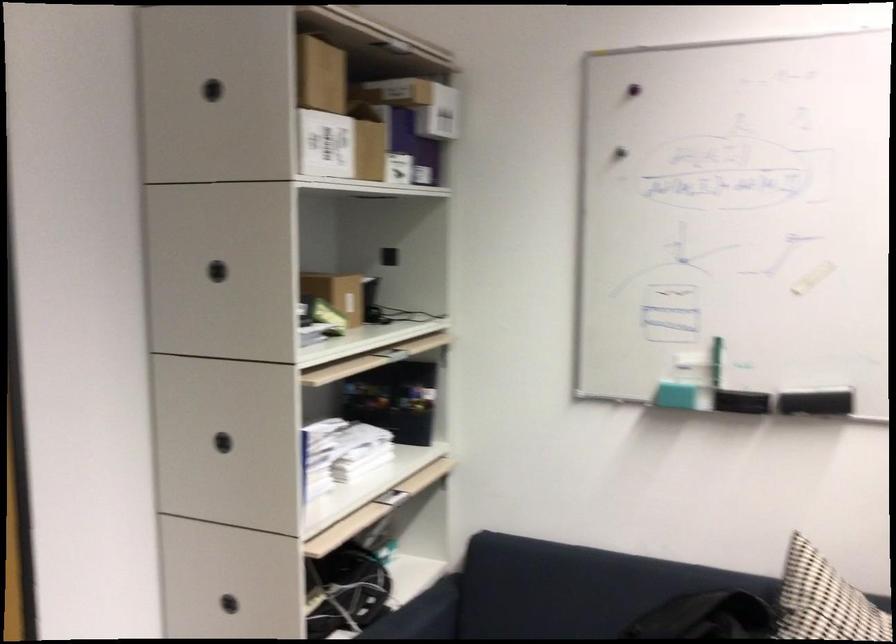
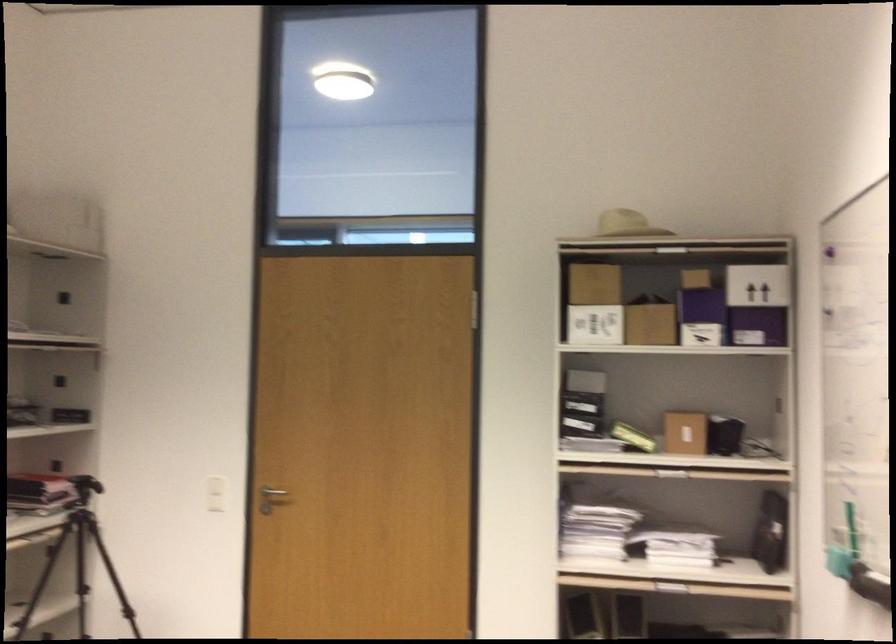
Where in the second image is the point corresponding to (x=377, y=147) from the first image?

(702, 317)